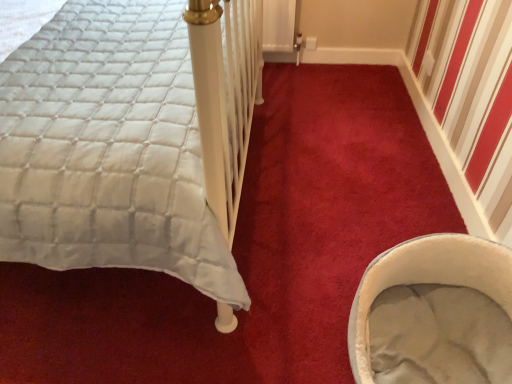
Locate an element on the screen. The height and width of the screenshot is (384, 512). vacant space situated on the left part of soft gray fabric baby carriage at lower right is located at coordinates (270, 311).